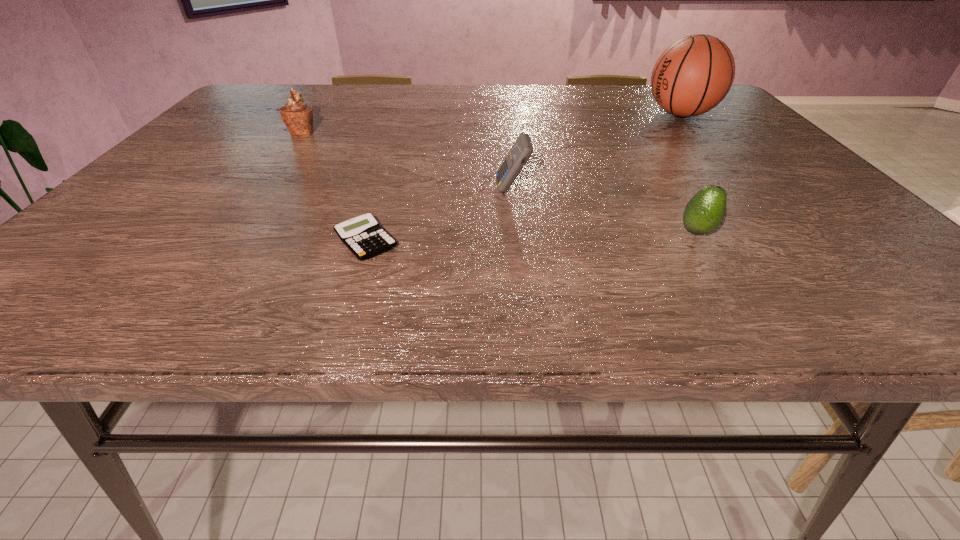
You are a GUI agent. You are given a task and a screenshot of the screen. Output one action in this format:
    pyautogui.click(x=<x>, y=<y>)
    Task: Click on the free space located on the surface of the rightmost object near the brand logo
    The image size is (960, 540).
    Given the screenshot: What is the action you would take?
    pyautogui.click(x=542, y=114)

Where is `vacant point located 0.230m on the surface of the rightmost object near the brand logo`? The image size is (960, 540). vacant point located 0.230m on the surface of the rightmost object near the brand logo is located at coordinates tap(564, 114).

Locate an element on the screen. vacant space located on the front-facing side of the right calculator is located at coordinates (307, 190).

Image resolution: width=960 pixels, height=540 pixels. I want to click on free space located on the front-facing side of the right calculator, so click(x=316, y=190).

Identify the location of vacant space located on the front-facing side of the right calculator. The height and width of the screenshot is (540, 960). (453, 190).

What are the coordinates of `vacant space located on the left of the leftmost object` in the screenshot? It's located at (222, 133).

Identify the location of free location located on the back of the second shortest object. (641, 145).

The image size is (960, 540). In order to click on free space located 0.100m on the left of the shorter calculator in this screenshot , I will do `click(277, 241)`.

Where is `object at the far edge`? This screenshot has height=540, width=960. object at the far edge is located at coordinates (693, 75).

The image size is (960, 540). What are the coordinates of `object present at the right edge` in the screenshot? It's located at (693, 75).